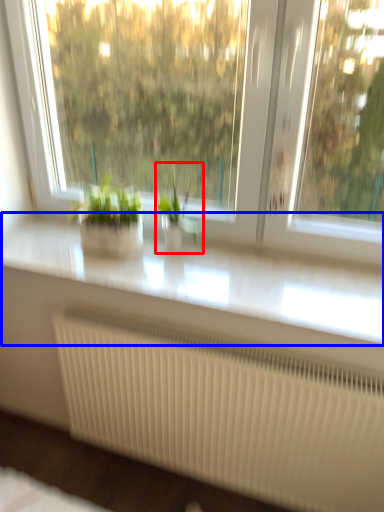
Question: Which object is further to the camera taking this photo, houseplant (highlighted by a red box) or counter top (highlighted by a blue box)?

Choices:
 (A) houseplant
 (B) counter top

Answer: (A)